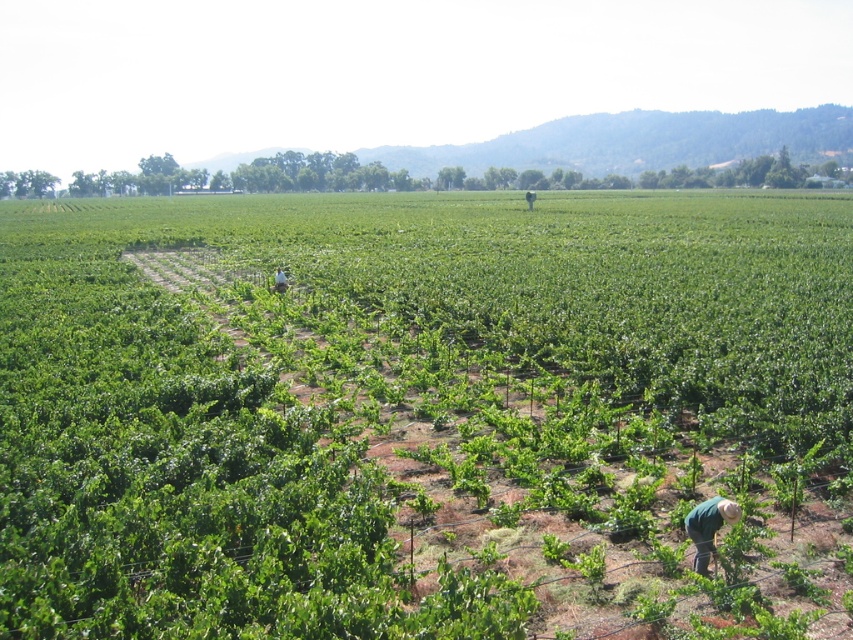
Question: Is green leafy plants at center below green fabric at center?

Choices:
 (A) yes
 (B) no

Answer: (B)

Question: Which point is closer to the camera?

Choices:
 (A) green fabric at center
 (B) green leafy plants at center

Answer: (B)

Question: Can you confirm if green fabric at lower right is positioned below green fabric at center?

Choices:
 (A) no
 (B) yes

Answer: (B)

Question: Which of the following is the closest to the observer?

Choices:
 (A) (282, 273)
 (B) (712, 502)
 (C) (440, 561)

Answer: (B)

Question: Is green fabric at lower right positioned behind green fabric at center?

Choices:
 (A) no
 (B) yes

Answer: (A)

Question: Which point is closer to the camera taking this photo?

Choices:
 (A) (711, 518)
 (B) (277, 272)

Answer: (A)